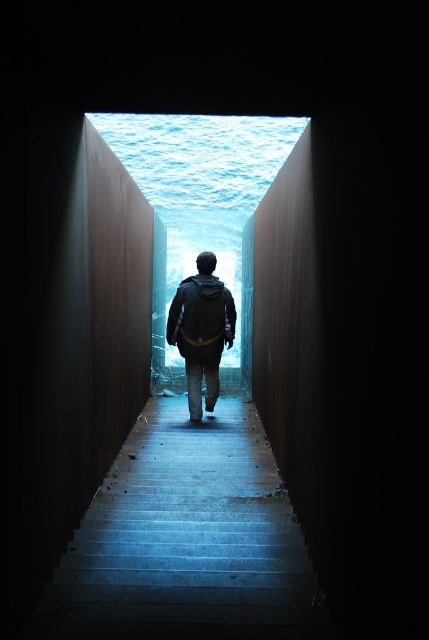
Question: Does concrete stairs at center appear over blue glass water at center?

Choices:
 (A) yes
 (B) no

Answer: (B)

Question: Which of these objects is positioned farthest from the concrete stairs at center?

Choices:
 (A) dark gray jacket at center
 (B) blue glass water at center

Answer: (B)

Question: Which point is closer to the camera?

Choices:
 (A) (213, 372)
 (B) (160, 310)
 (C) (190, 429)

Answer: (C)

Question: Is blue glass water at center above dark gray jacket at center?

Choices:
 (A) yes
 (B) no

Answer: (A)

Question: Based on their relative distances, which object is farther from the concrete stairs at center?

Choices:
 (A) dark gray jacket at center
 (B) blue glass water at center

Answer: (B)

Question: Does blue glass water at center have a smaller size compared to dark gray jacket at center?

Choices:
 (A) no
 (B) yes

Answer: (A)